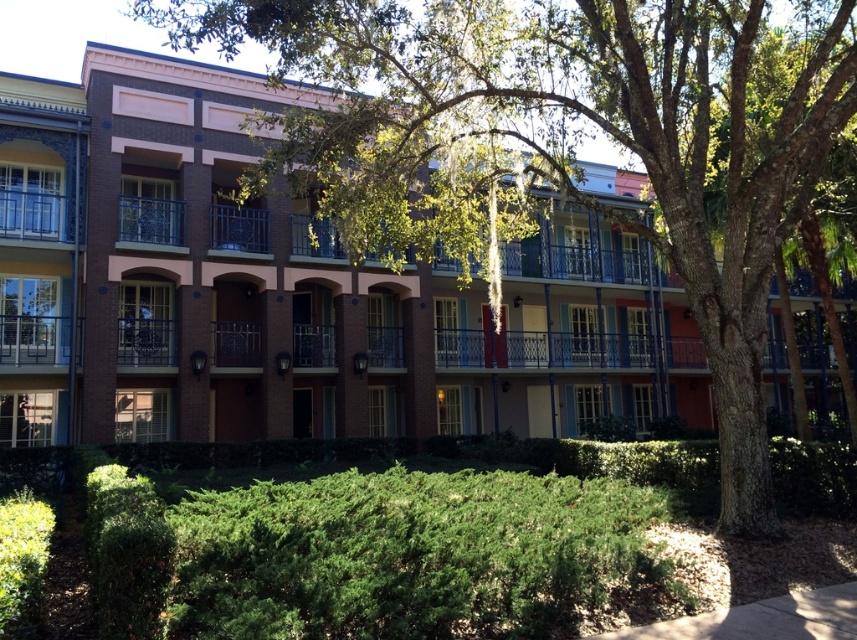
Who is shorter, green leafy tree at center or blue painted metal balcony at center?

Standing shorter between the two is green leafy tree at center.

Who is higher up, green leafy tree at center or blue painted metal balcony at center?

green leafy tree at center

I want to click on green leafy tree at center, so click(564, 141).

Which is more to the right, green leafy tree at center or metallic blue balcony at upper left?

green leafy tree at center

Is green leafy tree at center to the left of metallic blue balcony at upper left from the viewer's perspective?

Incorrect, green leafy tree at center is not on the left side of metallic blue balcony at upper left.

Between point (834, 90) and point (178, 232), which one is positioned behind?

The point (178, 232) is behind.

Find the location of `green leafy tree at center`. green leafy tree at center is located at coordinates (564, 141).

Can you confirm if blue painted metal balcony at center is positioned below metallic wrought iron balcony at center?

Indeed, blue painted metal balcony at center is positioned under metallic wrought iron balcony at center.

Is the position of blue painted metal balcony at center more distant than that of metallic wrought iron balcony at center?

That is True.

Who is more forward, (447, 346) or (256, 212)?

Point (256, 212) is in front.

Where is `blue painted metal balcony at center`? blue painted metal balcony at center is located at coordinates (564, 349).